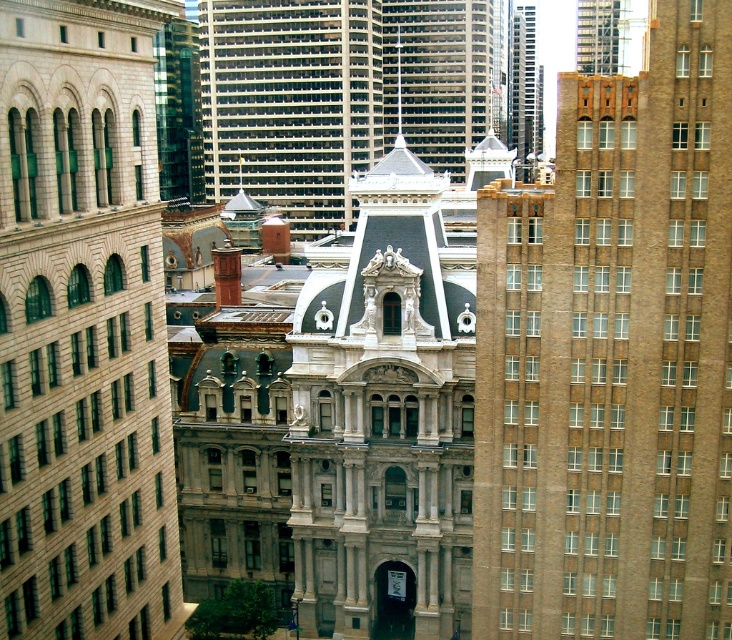
You are standing in the bustling urban scene and want to determine which of the two points, point (523, 22) or point (400, 109), is closer to you. Based on the scene description, which point is nearer?

Point (523, 22) is further to the viewer than point (400, 109), so the closer point to you is point (400, 109).

You are a city planner reviewing this urban layout. You need to determine the spatial relationship between the brown brick building at center and the beige stone building at left. Which building is located to the right of the other?

The brown brick building at center is positioned on the right side of beige stone building at left.

You are a drone operator tasked with flying a drone between the glassy steel skyscraper at upper center and the smooth gray spire at center. The drone has a maximum flight distance of 100 meters. Can the drone safely complete this flight without exceeding its range?

The glassy steel skyscraper at upper center is 114.43 meters away from the smooth gray spire at center. Since the drone has a maximum flight distance of 100 meters, it cannot safely complete the flight without exceeding its range.